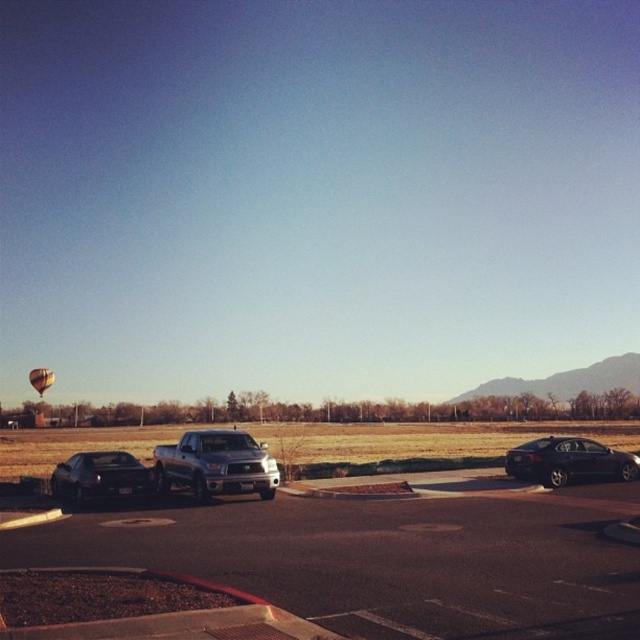
Is black matte sedan at right to the right of yellow fabric balloon at lower left from the viewer's perspective?

Correct, you'll find black matte sedan at right to the right of yellow fabric balloon at lower left.

You are a GUI agent. You are given a task and a screenshot of the screen. Output one action in this format:
    pyautogui.click(x=<x>, y=<y>)
    Task: Click on the black matte sedan at right
    The width and height of the screenshot is (640, 640).
    Given the screenshot: What is the action you would take?
    pyautogui.click(x=568, y=461)

At what (x,y) coordinates should I click in order to perform the action: click on black matte sedan at right. Please return your answer as a coordinate pair (x, y). Looking at the image, I should click on (568, 461).

Consider the image. Is matte silver truck at center to the right of shiny black sedan at left from the viewer's perspective?

Yes, matte silver truck at center is to the right of shiny black sedan at left.

Is matte silver truck at center taller than shiny black sedan at left?

In fact, matte silver truck at center may be shorter than shiny black sedan at left.

Is point (273, 497) positioned before point (120, 493)?

No, (273, 497) is further to viewer.

The width and height of the screenshot is (640, 640). Identify the location of matte silver truck at center. (216, 465).

Which is in front, point (531, 524) or point (211, 467)?

Positioned in front is point (531, 524).

What do you see at coordinates (385, 560) in the screenshot? The height and width of the screenshot is (640, 640). I see `smooth asphalt parking lot at center` at bounding box center [385, 560].

At what (x,y) coordinates should I click in order to perform the action: click on smooth asphalt parking lot at center. Please return your answer as a coordinate pair (x, y). The height and width of the screenshot is (640, 640). Looking at the image, I should click on [x=385, y=560].